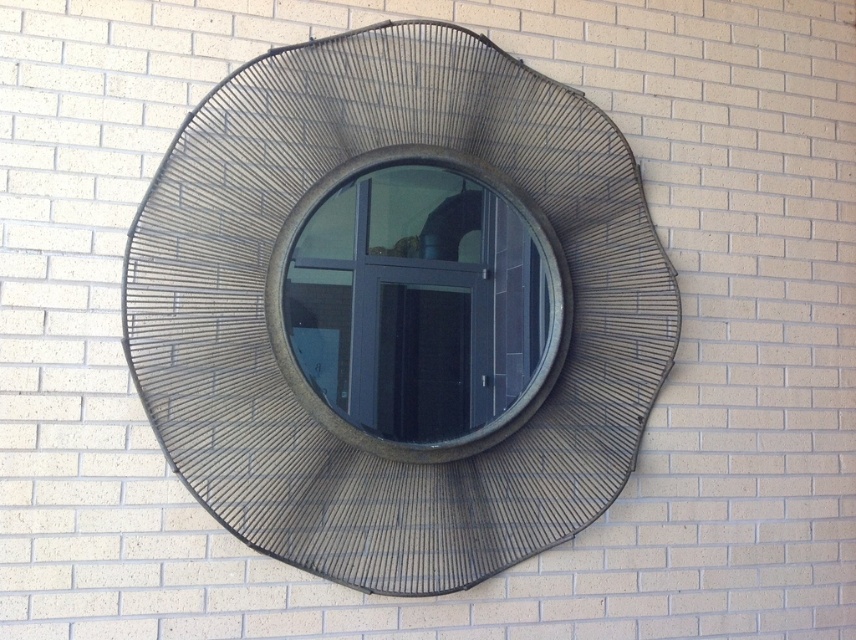
You are standing in front of a circular window with a decorative metal sunburst design. There is a specific point at coordinates point (x=640, y=292). If you want to touch this point with a 2 meter long stick, will you be able to reach it?

The distance between point (x=640, y=292) and the camera is 2.13 meters. Since the stick is only 2 meters long, you cannot reach the point with the stick.

You are an architect designing a new building and want to ensure that the metallic wire mesh at center does not block the view through the matte glass window at center. Based on the scene description, is this possible?

The metallic wire mesh at center is located above the matte glass window at center, so it does not block the view through the matte glass window at center.

You are an architect designing a new building and want to ensure that the metallic wire mesh at center and the matte glass window at center are proportionally balanced. Based on the scene described, which object should be adjusted in size to maintain visual harmony?

The metallic wire mesh at center might be wider than the matte glass window at center, so to maintain visual harmony, the matte glass window at center should be made wider to match the proportions of the metallic wire mesh at center.